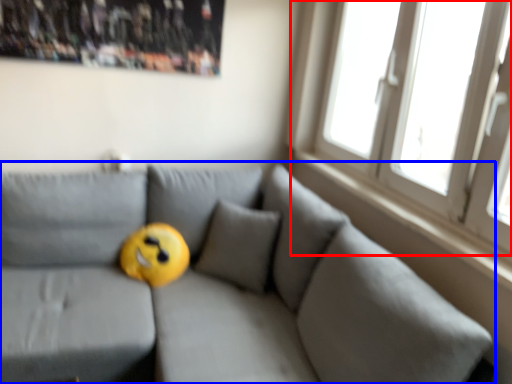
Question: Which point is closer to the camera, window (highlighted by a red box) or studio couch (highlighted by a blue box)?

Choices:
 (A) window
 (B) studio couch

Answer: (B)